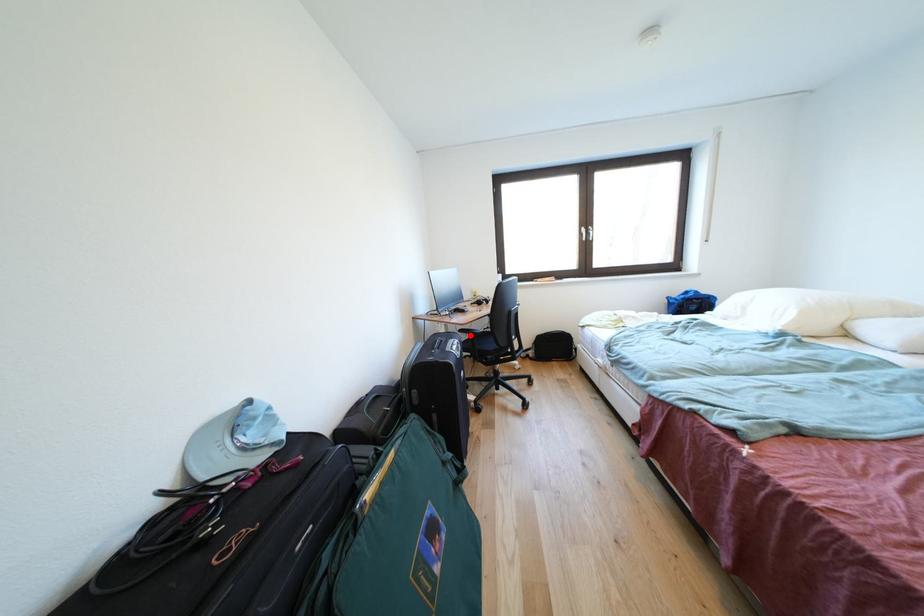
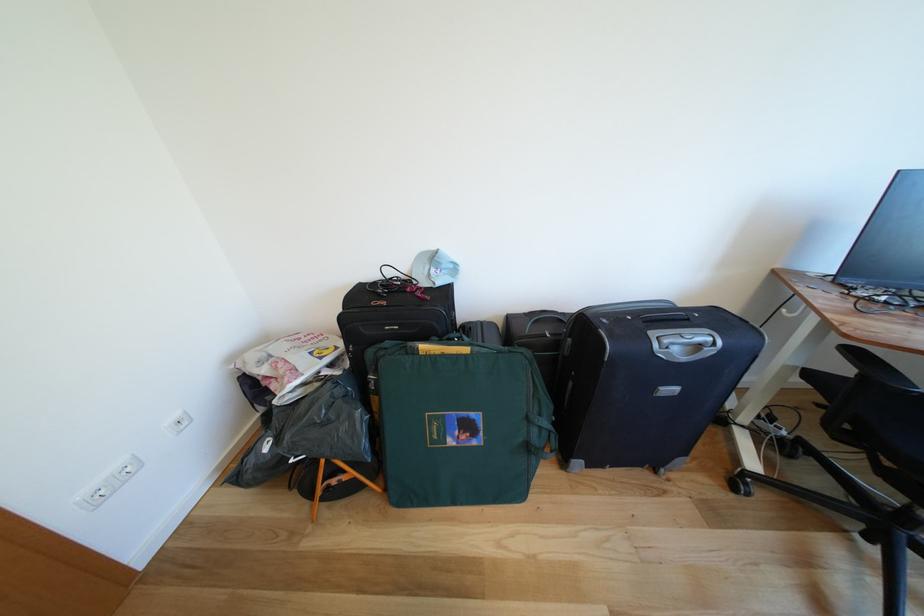
Find the pixel in the second image that matches the highlighted location in the first image.

(862, 357)